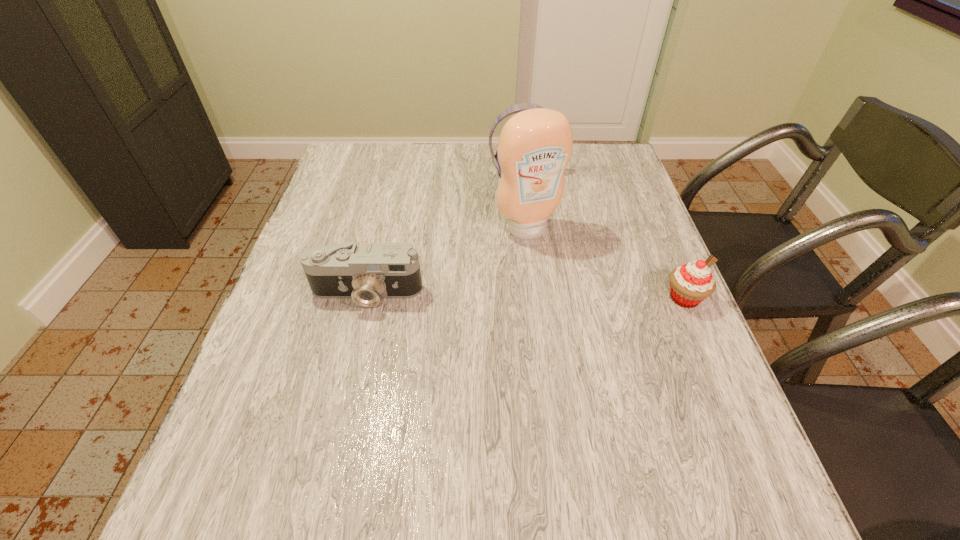
What are the coordinates of `vacant space situated 0.260m on the headband and ear cups of the third shortest object` in the screenshot? It's located at (544, 240).

Locate an element on the screen. The width and height of the screenshot is (960, 540). vacant point located 0.390m on the label of the third nearest object is located at coordinates point(613,368).

Locate an element on the screen. free spot located 0.220m on the label of the third nearest object is located at coordinates (576, 305).

At what (x,y) coordinates should I click in order to perform the action: click on vacant space located 0.380m on the label of the third nearest object. Please return your answer as a coordinate pair (x, y). Looking at the image, I should click on (612, 364).

Locate an element on the screen. The height and width of the screenshot is (540, 960). object located at the far edge is located at coordinates (516, 108).

At what (x,y) coordinates should I click in order to perform the action: click on object present at the left edge. Please return your answer as a coordinate pair (x, y). The width and height of the screenshot is (960, 540). Looking at the image, I should click on (366, 273).

Find the location of a particular element. The width and height of the screenshot is (960, 540). object positioned at the right edge is located at coordinates (690, 284).

The width and height of the screenshot is (960, 540). What are the coordinates of `free space at the far edge of the desktop` in the screenshot? It's located at (465, 159).

At what (x,y) coordinates should I click in order to perform the action: click on free region at the near edge of the desktop. Please return your answer as a coordinate pair (x, y). The width and height of the screenshot is (960, 540). Looking at the image, I should click on (402, 411).

This screenshot has height=540, width=960. What are the coordinates of `vacant space at the left edge of the desktop` in the screenshot? It's located at (349, 218).